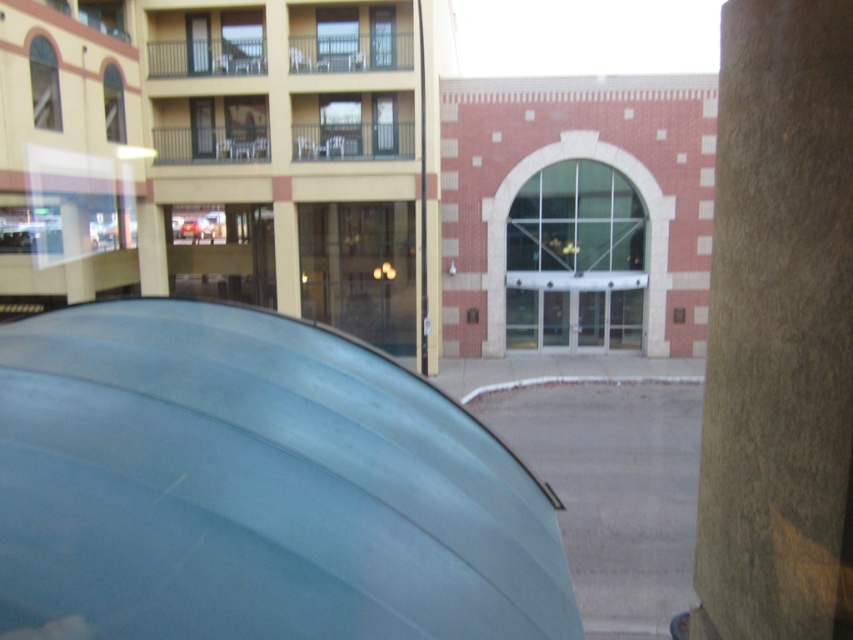
Is matte blue car at center below metallic silver car at center?

Yes.

Describe the element at coordinates (254, 486) in the screenshot. I see `matte blue car at center` at that location.

Identify the location of matte blue car at center. click(254, 486).

Can you confirm if brown stone pillar at right is smaller than metallic silver car at center?

No.

Is point (740, 608) more distant than point (196, 230)?

No, it is in front of (196, 230).

The width and height of the screenshot is (853, 640). Find the location of `brown stone pillar at right`. brown stone pillar at right is located at coordinates (779, 332).

Locate an element on the screen. The height and width of the screenshot is (640, 853). brown stone pillar at right is located at coordinates (779, 332).

Can you confirm if matte blue car at center is bigger than brown stone pillar at right?

No.

Is matte blue car at center further to camera compared to brown stone pillar at right?

Yes, matte blue car at center is behind brown stone pillar at right.

Which is behind, point (323, 346) or point (848, 348)?

The point (323, 346) is behind.

Find the location of a particular element. matte blue car at center is located at coordinates (254, 486).